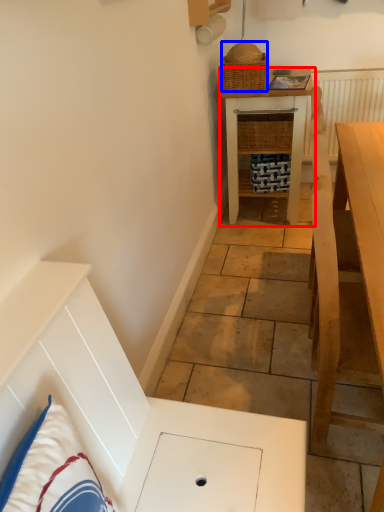
Question: Which of the following is the farthest to the observer, table (highlighted by a red box) or picnic basket (highlighted by a blue box)?

Choices:
 (A) table
 (B) picnic basket

Answer: (A)